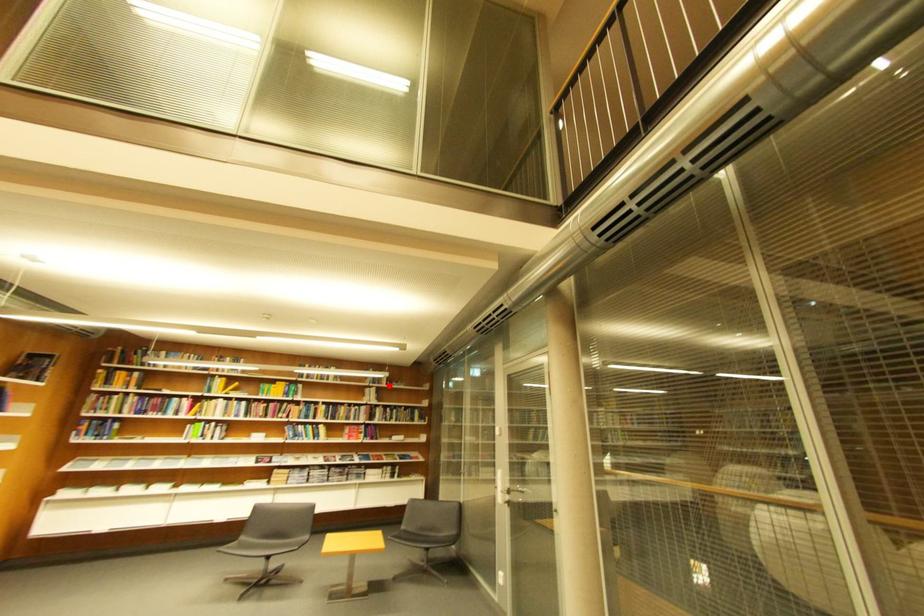
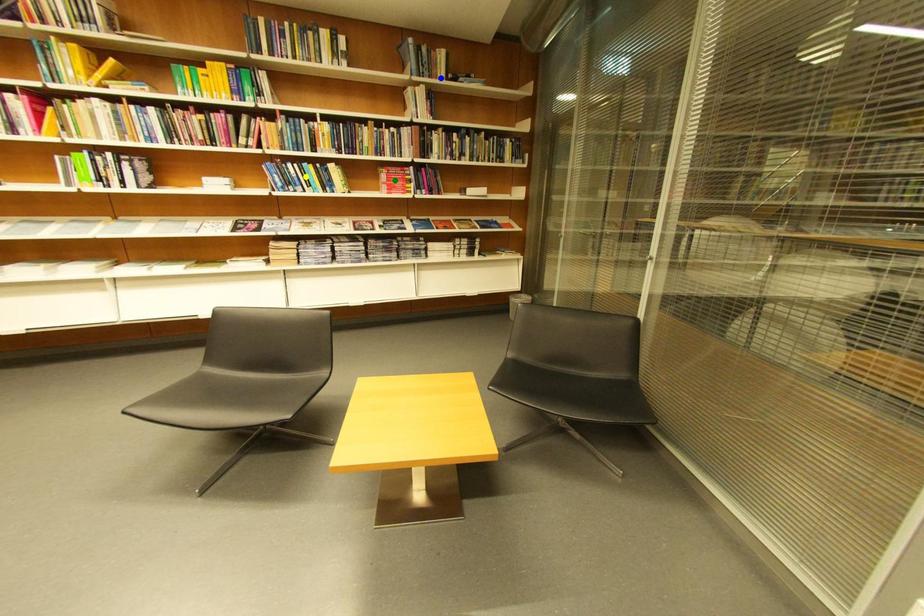
Question: I am providing you with two images of the same scene from different viewpoints. A red point is marked on the first image. You are given multiple points on the second image. Can you choose the point in image 2 that corresponds to the point in image 1?

Choices:
 (A) green point
 (B) yellow point
 (C) blue point

Answer: (C)